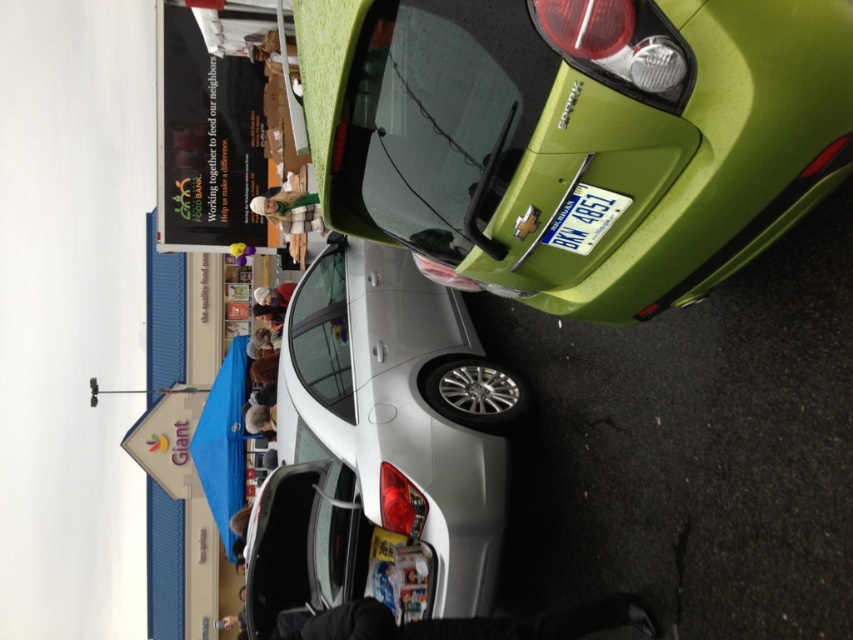
Question: Which object is the closest to the blue metallic license plate at center?

Choices:
 (A) satin silver sedan at center
 (B) green matte car at upper right

Answer: (B)

Question: Which point appears farthest from the camera in this image?

Choices:
 (A) (595, 237)
 (B) (550, 92)
 (C) (292, 404)

Answer: (C)

Question: Is green matte car at upper right thinner than satin silver sedan at center?

Choices:
 (A) yes
 (B) no

Answer: (B)

Question: Does green matte car at upper right appear over blue metallic license plate at center?

Choices:
 (A) no
 (B) yes

Answer: (B)

Question: Is green matte car at upper right smaller than blue metallic license plate at center?

Choices:
 (A) no
 (B) yes

Answer: (A)

Question: Which object is the closest to the satin silver sedan at center?

Choices:
 (A) blue metallic license plate at center
 (B) green matte car at upper right

Answer: (B)